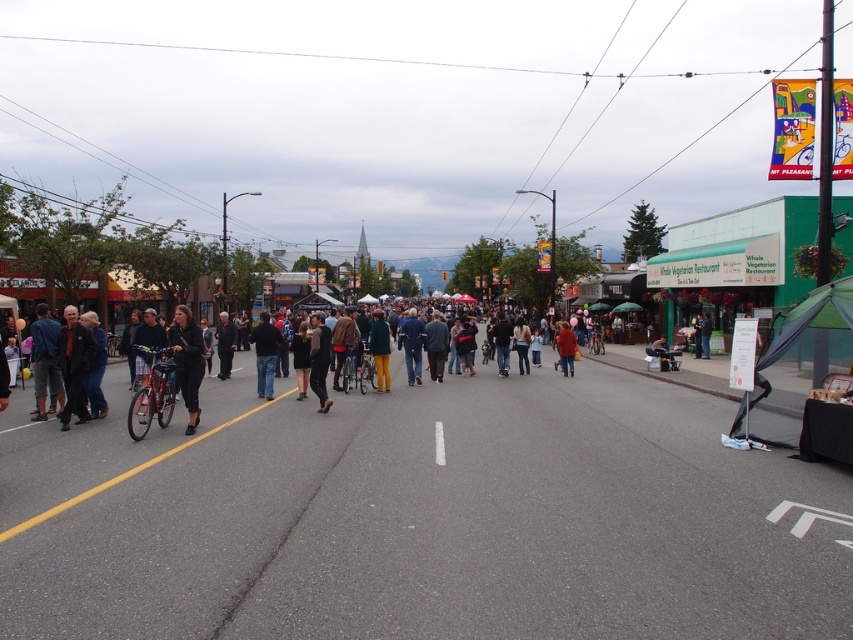
You are standing in the middle of the street and want to take a photo that includes both the point at coordinates point (259,356) and the point at coordinates point (421,362). Which point should you focus on first to ensure both are in focus?

You should focus on the point at coordinates point (259,356) first because it is closer to the camera, ensuring that both points will be in focus when using a depth of field that covers their distance range.

You are standing on the lively street scene and see both the matte black jacket at center and the red sweater at center. Which one is positioned more to the left side from your perspective?

The matte black jacket at center is positioned to the left of the red sweater at center, so the matte black jacket at center is more to the left side.